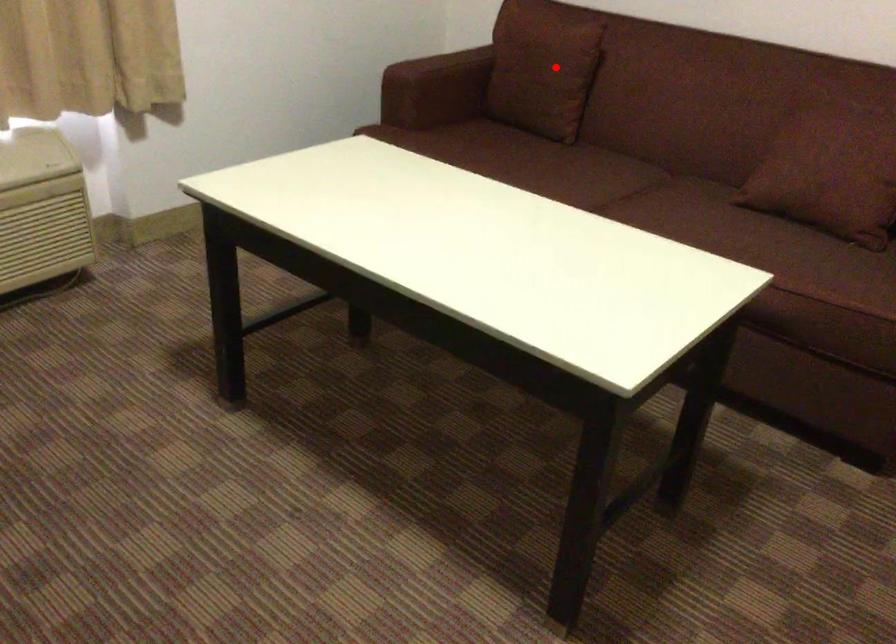
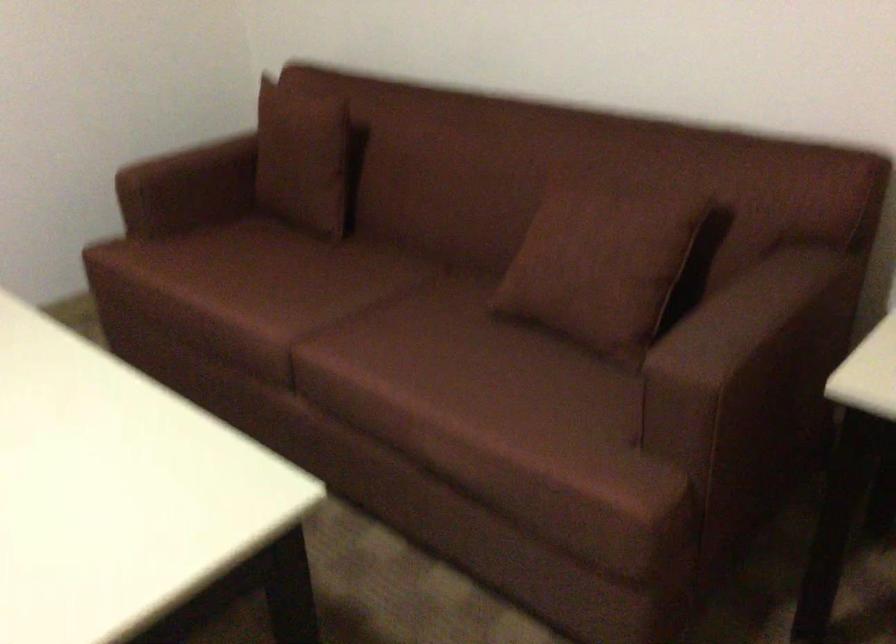
Locate, in the second image, the point that corresponds to the highlighted location in the first image.

(306, 158)